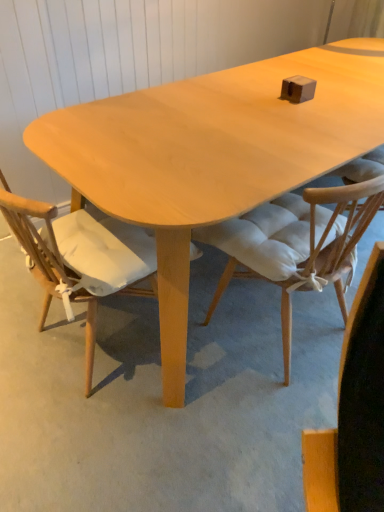
Locate an element on the screen. free space on the front side of white padded chair at center, which appears as the 1th chair when viewed from the right is located at coordinates (244, 422).